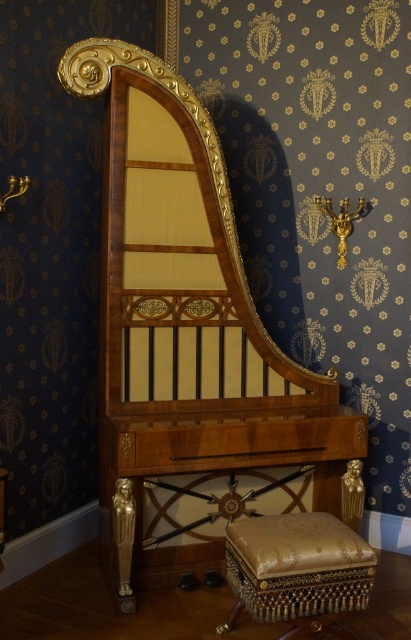
Question: Observing the image, what is the correct spatial positioning of walnut wood harpsichord at center in reference to gold textured cushion at lower center?

Choices:
 (A) above
 (B) below

Answer: (A)

Question: Is walnut wood harpsichord at center further to camera compared to gold textured cushion at lower center?

Choices:
 (A) no
 (B) yes

Answer: (B)

Question: Which of the following is the farthest from the observer?

Choices:
 (A) (254, 608)
 (B) (154, 429)

Answer: (B)

Question: Which point is closer to the camera?

Choices:
 (A) (253, 584)
 (B) (203, 353)

Answer: (A)

Question: Does walnut wood harpsichord at center have a greater width compared to gold textured cushion at lower center?

Choices:
 (A) no
 (B) yes

Answer: (B)